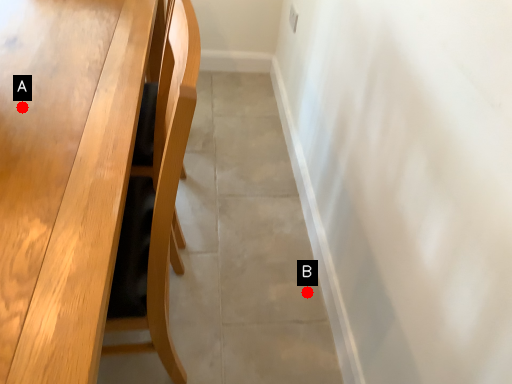
Question: Two points are circled on the image, labeled by A and B beside each circle. Which point appears farthest from the camera in this image?

Choices:
 (A) A is further
 (B) B is further

Answer: (B)